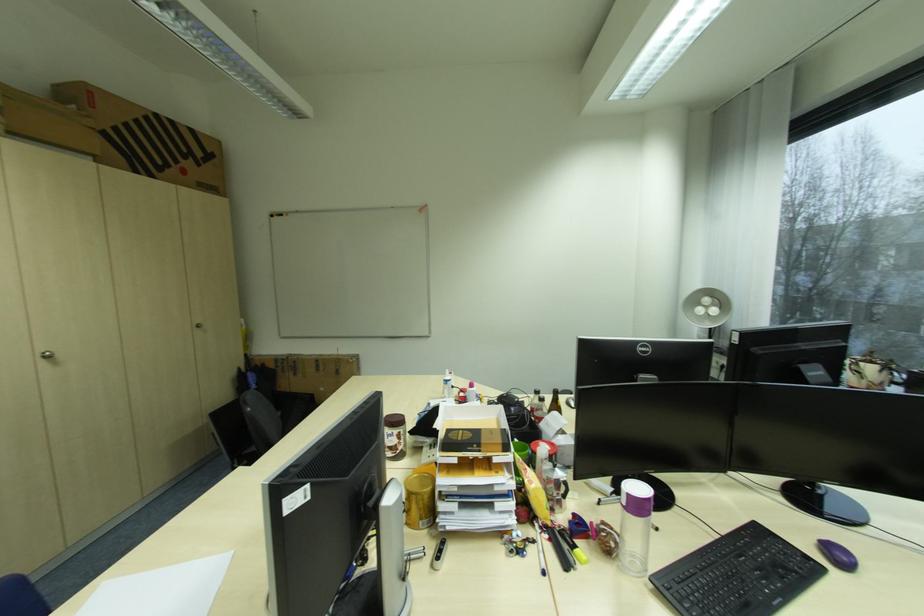
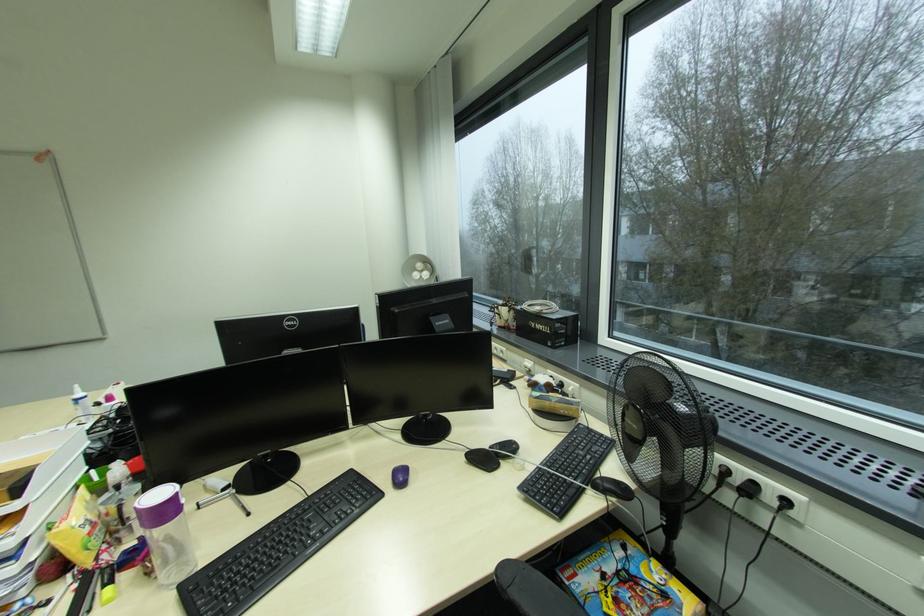
Find the pixel in the second image that matches (616,553) in the first image.

(159, 573)